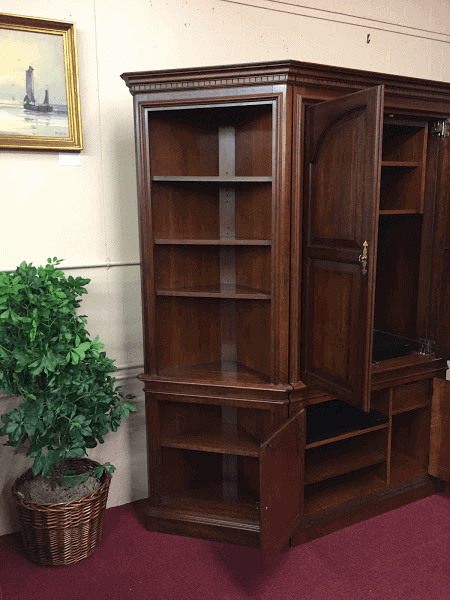
Locate an element on the screen. hinges is located at coordinates (423, 348).